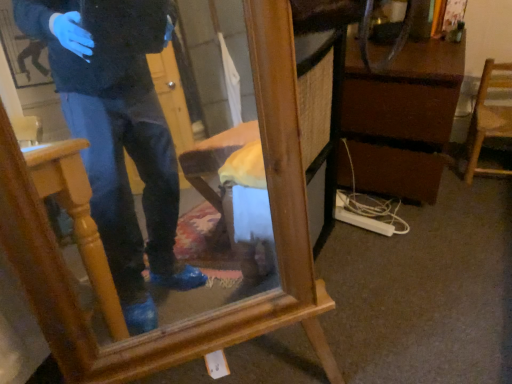
Question: Can wooden mirror at center be found inside wooden chair at right?

Choices:
 (A) yes
 (B) no

Answer: (B)

Question: Is the depth of wooden chair at right less than that of wooden mirror at center?

Choices:
 (A) no
 (B) yes

Answer: (A)

Question: Is there a large distance between wooden chair at right and wooden mirror at center?

Choices:
 (A) no
 (B) yes

Answer: (B)

Question: Is wooden chair at right bigger than wooden mirror at center?

Choices:
 (A) yes
 (B) no

Answer: (B)

Question: Is wooden chair at right shorter than wooden mirror at center?

Choices:
 (A) no
 (B) yes

Answer: (B)

Question: From a real-world perspective, is wooden chair at right positioned over wooden mirror at center based on gravity?

Choices:
 (A) no
 (B) yes

Answer: (A)

Question: Is wooden mirror at center not within wooden chair at right?

Choices:
 (A) no
 (B) yes

Answer: (B)

Question: Is wooden mirror at center bigger than wooden chair at right?

Choices:
 (A) no
 (B) yes

Answer: (B)

Question: Is wooden mirror at center facing towards wooden chair at right?

Choices:
 (A) yes
 (B) no

Answer: (B)

Question: Is wooden mirror at center far from wooden chair at right?

Choices:
 (A) no
 (B) yes

Answer: (B)

Question: Is wooden mirror at center positioned with its back to wooden chair at right?

Choices:
 (A) yes
 (B) no

Answer: (B)

Question: Is the position of wooden mirror at center more distant than that of wooden chair at right?

Choices:
 (A) no
 (B) yes

Answer: (A)

Question: Is wooden chair at right smaller than brown wood vanity at center right?

Choices:
 (A) yes
 (B) no

Answer: (A)